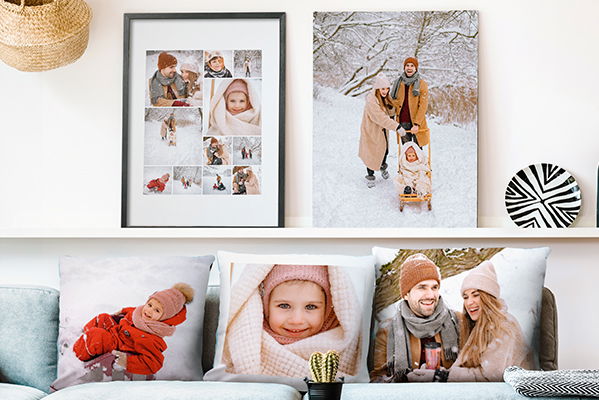
Where is `pictures`? pictures is located at coordinates (216, 137), (383, 139), (417, 299), (235, 291), (119, 284).